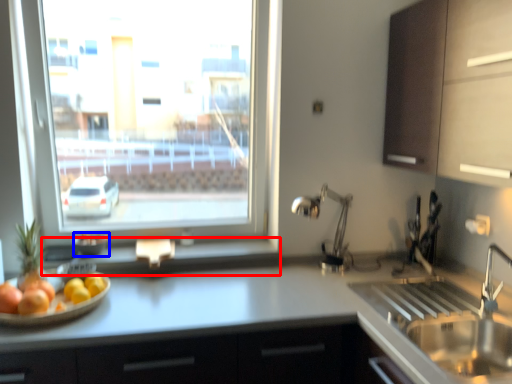
Question: Which of the following is the farthest to the observer, window sill (highlighted by a red box) or glass bowl (highlighted by a blue box)?

Choices:
 (A) window sill
 (B) glass bowl

Answer: (B)